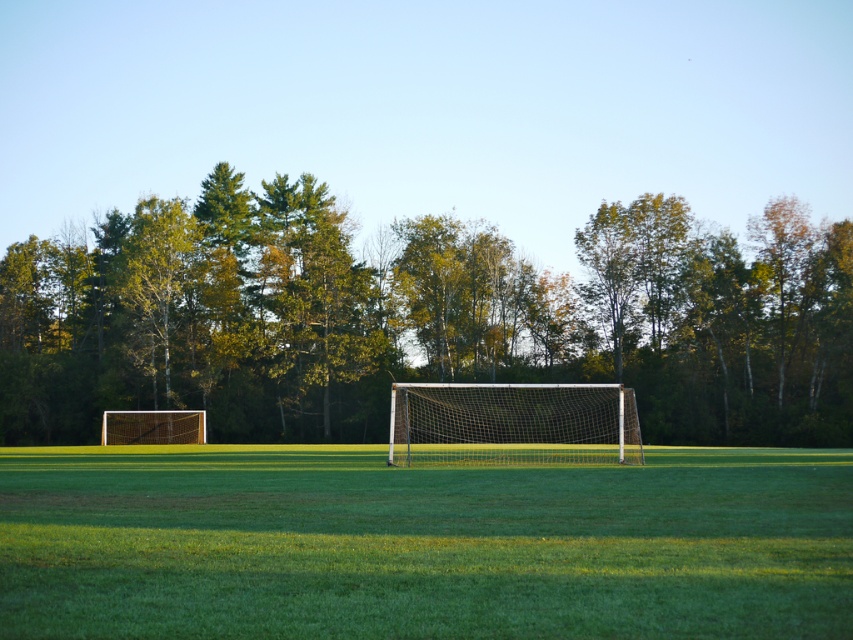
Who is more forward, (532,394) or (125,420)?

Point (532,394) is in front.

Does white mesh net at center lie behind metallic silver goal at left?

No, it is not.

This screenshot has width=853, height=640. Identify the location of white mesh net at center. (512, 424).

Who is higher up, green leafy tree at center or metallic silver goal at left?

green leafy tree at center is above.

Measure the distance between green leafy tree at center and camera.

green leafy tree at center and camera are 66.18 meters apart from each other.

Image resolution: width=853 pixels, height=640 pixels. Find the location of `green leafy tree at center`. green leafy tree at center is located at coordinates (419, 317).

Between green grass at center and metallic silver goal at left, which one appears on the left side from the viewer's perspective?

From the viewer's perspective, metallic silver goal at left appears more on the left side.

Which is behind, point (32, 579) or point (131, 444)?

The point (131, 444) is more distant.

You are a GUI agent. You are given a task and a screenshot of the screen. Output one action in this format:
    pyautogui.click(x=<x>, y=<y>)
    Task: Click on the green grass at center
    The image size is (853, 640).
    Given the screenshot: What is the action you would take?
    pyautogui.click(x=421, y=545)